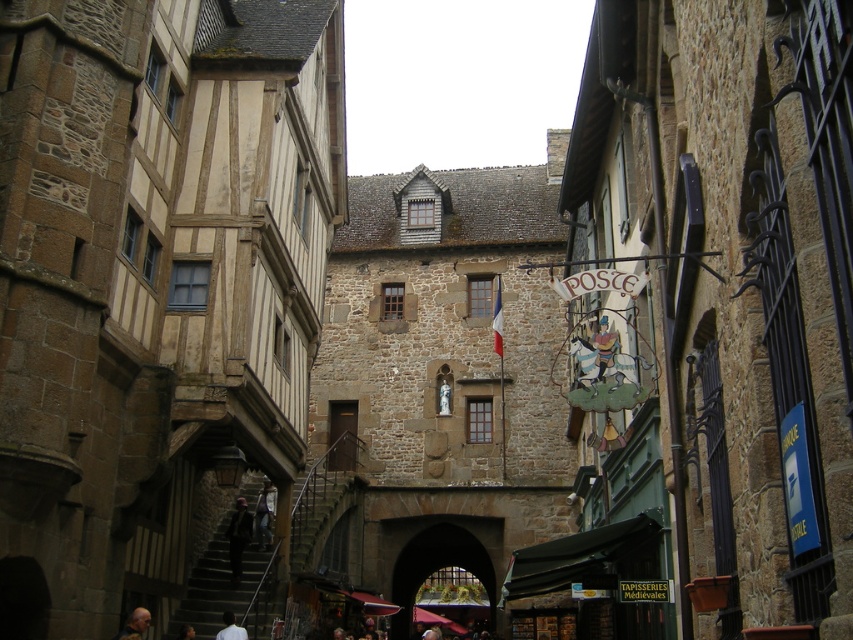
You are a tailor observing the dark gray fabric jacket at lower center and the dark brown leather jacket at lower left in the medieval street scene. Which jacket appears taller?

The dark gray fabric jacket at lower center appears taller than the dark brown leather jacket at lower left.

You are standing in the medieval street scene and want to know how far the point at coordinates (264, 516) is from you. Can you determine the distance?

The distance between the point at coordinates (264, 516) and the viewer is 74.88 meters.